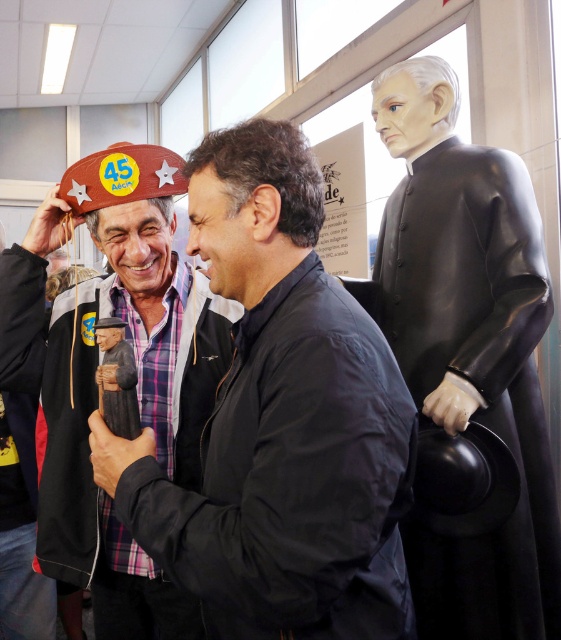
Question: Estimate the real-world distances between objects in this image. Which object is closer to the brown leather hat at upper left?

Choices:
 (A) matte brown hat at left
 (B) black glossy statue at right

Answer: (A)

Question: Which object is the closest to the matte brown hat at left?

Choices:
 (A) brown leather hat at upper left
 (B) black glossy statue at right

Answer: (A)

Question: Can you confirm if black glossy statue at right is positioned below brown leather hat at upper left?

Choices:
 (A) no
 (B) yes

Answer: (A)

Question: Which object appears closest to the camera in this image?

Choices:
 (A) black glossy statue at right
 (B) brown leather hat at upper left
 (C) matte brown hat at left

Answer: (C)

Question: Is matte brown hat at left to the left of brown leather hat at upper left from the viewer's perspective?

Choices:
 (A) yes
 (B) no

Answer: (B)

Question: Does matte brown hat at left appear over brown leather hat at upper left?

Choices:
 (A) no
 (B) yes

Answer: (B)